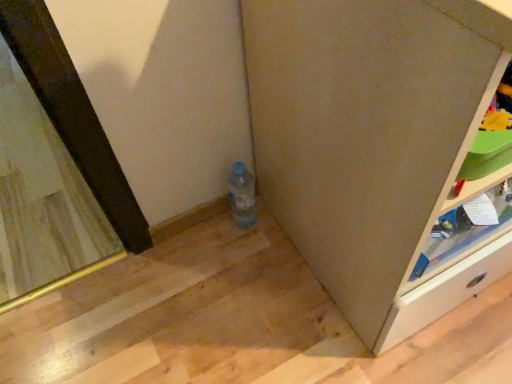
Describe the element at coordinates (42, 199) in the screenshot. This screenshot has width=512, height=384. I see `wooden frame mirror at left` at that location.

This screenshot has height=384, width=512. I want to click on matte gray cabinet at lower right, so click(x=375, y=145).

The image size is (512, 384). In order to click on wooden frame mirror at left in this screenshot , I will do `click(42, 199)`.

Can you confirm if wooden frame mirror at left is bigger than light brown wooden shelf at right?

Indeed, wooden frame mirror at left has a larger size compared to light brown wooden shelf at right.

Can you see wooden frame mirror at left touching light brown wooden shelf at right?

No, wooden frame mirror at left is not beside light brown wooden shelf at right.

Is wooden frame mirror at left at the right side of light brown wooden shelf at right?

No, wooden frame mirror at left is not to the right of light brown wooden shelf at right.

Does wooden frame mirror at left have a greater width compared to light brown wooden shelf at right?

Correct, the width of wooden frame mirror at left exceeds that of light brown wooden shelf at right.

Which object is more forward, wooden frame mirror at left or translucent plastic bottle at center?

translucent plastic bottle at center.

From a real-world perspective, which is physically below, wooden frame mirror at left or translucent plastic bottle at center?

wooden frame mirror at left.

Locate an element on the screen. The image size is (512, 384). bottle above the wooden frame mirror at left (from a real-world perspective) is located at coordinates (242, 195).

In terms of size, does wooden frame mirror at left appear bigger or smaller than translucent plastic bottle at center?

wooden frame mirror at left is bigger than translucent plastic bottle at center.

Who is smaller, translucent plastic bottle at center or wooden frame mirror at left?

translucent plastic bottle at center is smaller.

Does translucent plastic bottle at center appear on the right side of wooden frame mirror at left?

Yes.

Between translucent plastic bottle at center and wooden frame mirror at left, which one has more height?

translucent plastic bottle at center is taller.

Which of these two, translucent plastic bottle at center or wooden frame mirror at left, is thinner?

With smaller width is translucent plastic bottle at center.

Is translucent plastic bottle at center far away from matte gray cabinet at lower right?

No, there isn't a large distance between translucent plastic bottle at center and matte gray cabinet at lower right.

Is translucent plastic bottle at center bigger than matte gray cabinet at lower right?

No, translucent plastic bottle at center is not bigger than matte gray cabinet at lower right.

Between translucent plastic bottle at center and matte gray cabinet at lower right, which one is positioned in front?

matte gray cabinet at lower right is closer to the camera.

Looking at this image, from a real-world perspective, is matte gray cabinet at lower right over wooden frame mirror at left?

Yes, from a real-world perspective, matte gray cabinet at lower right is on top of wooden frame mirror at left.

What's the angular difference between matte gray cabinet at lower right and wooden frame mirror at left's facing directions?

The angular difference between matte gray cabinet at lower right and wooden frame mirror at left is 0.417 degrees.

Is wooden frame mirror at left inside matte gray cabinet at lower right?

No, wooden frame mirror at left is located outside of matte gray cabinet at lower right.

In the image, is matte gray cabinet at lower right on the left side or the right side of wooden frame mirror at left?

matte gray cabinet at lower right is positioned on wooden frame mirror at left's right side.

Who is taller, matte gray cabinet at lower right or light brown wooden shelf at right?

With more height is matte gray cabinet at lower right.

Which is in front, matte gray cabinet at lower right or light brown wooden shelf at right?

Positioned in front is matte gray cabinet at lower right.

Between matte gray cabinet at lower right and light brown wooden shelf at right, which one has smaller width?

Thinner between the two is light brown wooden shelf at right.

Is matte gray cabinet at lower right not within light brown wooden shelf at right?

Absolutely, matte gray cabinet at lower right is external to light brown wooden shelf at right.

From a real-world perspective, is light brown wooden shelf at right physically located above or below translucent plastic bottle at center?

light brown wooden shelf at right is above translucent plastic bottle at center.

Which is closer to the camera, (472,226) or (233,185)?

Clearly, point (472,226) is closer to the camera than point (233,185).

From the image's perspective, does light brown wooden shelf at right appear higher than translucent plastic bottle at center?

Actually, light brown wooden shelf at right appears below translucent plastic bottle at center in the image.

Between light brown wooden shelf at right and translucent plastic bottle at center, which one has smaller width?

translucent plastic bottle at center.

I want to click on mirror on the left of light brown wooden shelf at right, so click(x=42, y=199).

This screenshot has width=512, height=384. Identify the location of bottle to the right of wooden frame mirror at left. (242, 195).

Based on their spatial positions, is wooden frame mirror at left or matte gray cabinet at lower right further from light brown wooden shelf at right?

Based on the image, wooden frame mirror at left appears to be further to light brown wooden shelf at right.

Looking at the image, which one is located further to wooden frame mirror at left, matte gray cabinet at lower right or translucent plastic bottle at center?

Based on the image, matte gray cabinet at lower right appears to be further to wooden frame mirror at left.

Based on their spatial positions, is translucent plastic bottle at center or matte gray cabinet at lower right further from wooden frame mirror at left?

The object further to wooden frame mirror at left is matte gray cabinet at lower right.

Based on their spatial positions, is translucent plastic bottle at center or matte gray cabinet at lower right further from light brown wooden shelf at right?

Among the two, translucent plastic bottle at center is located further to light brown wooden shelf at right.

From the image, which object appears to be farther from light brown wooden shelf at right, matte gray cabinet at lower right or translucent plastic bottle at center?

The object further to light brown wooden shelf at right is translucent plastic bottle at center.

From the image, which object appears to be farther from translucent plastic bottle at center, wooden frame mirror at left or matte gray cabinet at lower right?

wooden frame mirror at left.

Considering their positions, is translucent plastic bottle at center positioned further to matte gray cabinet at lower right than light brown wooden shelf at right?

Based on the image, translucent plastic bottle at center appears to be further to matte gray cabinet at lower right.

From the image, which object appears to be farther from light brown wooden shelf at right, matte gray cabinet at lower right or wooden frame mirror at left?

Among the two, wooden frame mirror at left is located further to light brown wooden shelf at right.

At what (x,y) coordinates should I click in order to perform the action: click on shelf between wooden frame mirror at left and matte gray cabinet at lower right in the horizontal direction. Please return your answer as a coordinate pair (x, y). This screenshot has height=384, width=512. Looking at the image, I should click on (468, 198).

Where is `bottle between wooden frame mirror at left and matte gray cabinet at lower right in the horizontal direction`? bottle between wooden frame mirror at left and matte gray cabinet at lower right in the horizontal direction is located at coordinates (x=242, y=195).

Where is `bottle between wooden frame mirror at left and light brown wooden shelf at right from left to right`? This screenshot has width=512, height=384. bottle between wooden frame mirror at left and light brown wooden shelf at right from left to right is located at coordinates (242, 195).

At what (x,y) coordinates should I click in order to perform the action: click on shelf between matte gray cabinet at lower right and translucent plastic bottle at center from front to back. Please return your answer as a coordinate pair (x, y). Looking at the image, I should click on (468, 198).